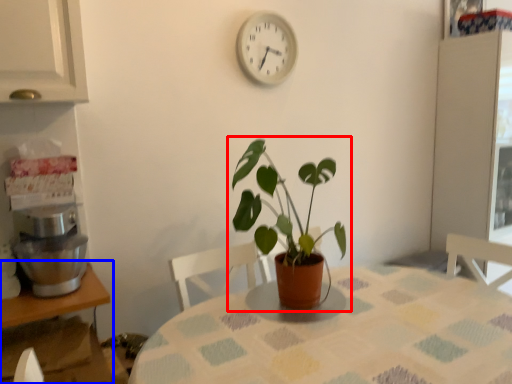
Question: Which point is closer to the camera, houseplant (highlighted by a red box) or table (highlighted by a blue box)?

Choices:
 (A) houseplant
 (B) table

Answer: (B)